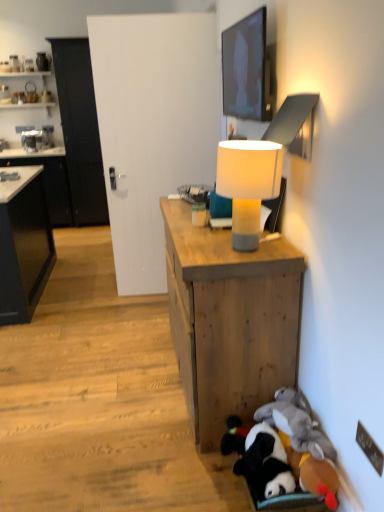
Question: Can you confirm if wooden desk at center is positioned to the right of black matte cabinet at left, the 2th cabinetry positioned from the right?

Choices:
 (A) yes
 (B) no

Answer: (A)

Question: Can you confirm if wooden desk at center is taller than black matte cabinet at left, marked as the 1th cabinetry in a left-to-right arrangement?

Choices:
 (A) yes
 (B) no

Answer: (B)

Question: Can you confirm if wooden desk at center is bigger than black matte cabinet at left, the 2th cabinetry positioned from the right?

Choices:
 (A) no
 (B) yes

Answer: (A)

Question: Is wooden desk at center far from black matte cabinet at left, the 2th cabinetry positioned from the right?

Choices:
 (A) yes
 (B) no

Answer: (A)

Question: Is wooden desk at center thinner than black matte cabinet at left, marked as the 1th cabinetry in a left-to-right arrangement?

Choices:
 (A) yes
 (B) no

Answer: (A)

Question: Is wooden desk at center turned away from black matte cabinet at left, marked as the 1th cabinetry in a left-to-right arrangement?

Choices:
 (A) no
 (B) yes

Answer: (A)

Question: Are black glossy cabinet at left, the 2th cabinetry from the left, and white fabric lampshade at center located far from each other?

Choices:
 (A) no
 (B) yes

Answer: (B)

Question: Does black glossy cabinet at left, the 2th cabinetry from the left, have a greater width compared to white fabric lampshade at center?

Choices:
 (A) no
 (B) yes

Answer: (B)

Question: Is black glossy cabinet at left, the 2th cabinetry from the left, to the right of white fabric lampshade at center from the viewer's perspective?

Choices:
 (A) yes
 (B) no

Answer: (B)

Question: From a real-world perspective, is black glossy cabinet at left, positioned as the 1th cabinetry in right-to-left order, on white fabric lampshade at center?

Choices:
 (A) yes
 (B) no

Answer: (B)

Question: Would you say white fabric lampshade at center is part of black glossy cabinet at left, positioned as the 1th cabinetry in right-to-left order,'s contents?

Choices:
 (A) no
 (B) yes

Answer: (A)

Question: From a real-world perspective, is black glossy cabinet at left, the 2th cabinetry from the left, located beneath white fabric lampshade at center?

Choices:
 (A) no
 (B) yes

Answer: (B)

Question: Is matte black tv at upper center completely or partially outside of black matte cabinet at left, marked as the 1th cabinetry in a left-to-right arrangement?

Choices:
 (A) yes
 (B) no

Answer: (A)